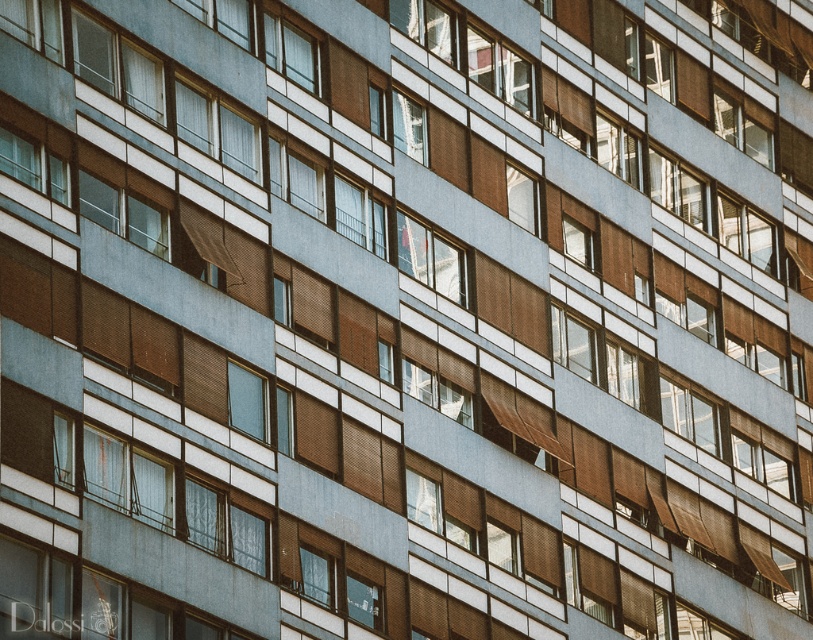
You are standing directly in front of the building facade. Which object from the following list is located at the coordinate point 0.083, 0.359? 1. clear glass window at upper center 2. brown blind window at lower left

The clear glass window at upper center is located at point (290, 52).

You are standing in front of the building and notice two windows. One is the clear glass window at upper center and the other is the transparent glass window at center. Which window is positioned more to the left?

The clear glass window at upper center is positioned more to the left than the transparent glass window at center.